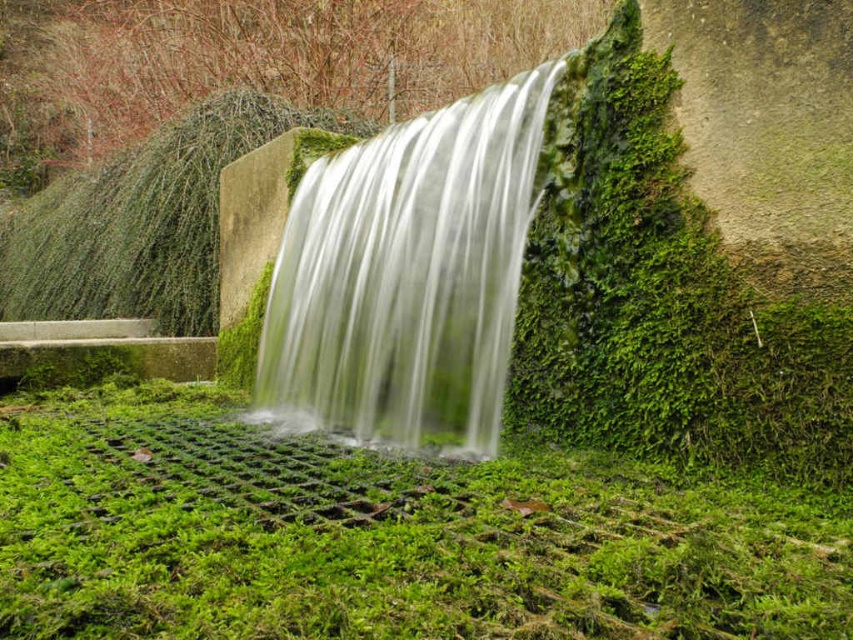
You are standing at the bottom of the waterfall and want to step onto the green mossy grass at center. Which direction should you move relative to the green mossy waterfall at center?

The green mossy grass at center is positioned on the left side of the green mossy waterfall at center, so you should move to the left relative to the waterfall to reach the grass.

You are standing in the natural scene and want to cross to the other side. You see the green mossy grass at center and the green mossy waterfall at center. Which object should you avoid stepping on if you want to stay dry?

You should avoid stepping on the green mossy waterfall at center because the green mossy grass at center is below it, and the waterfall is flowing down, so the grass area might be drier compared to the waterfall which is actively flowing water.